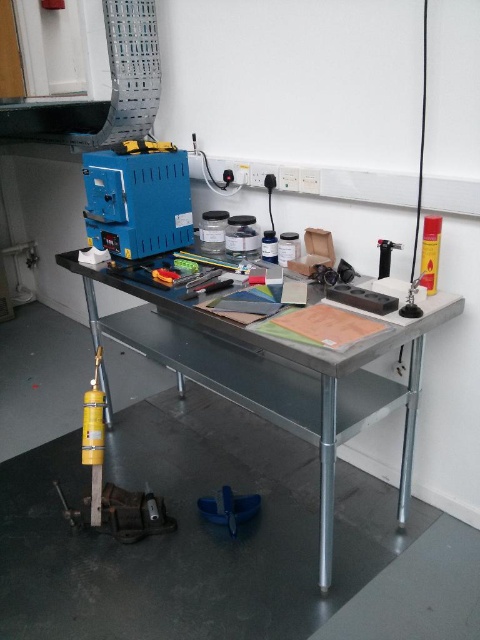
Which is in front, point (152, 216) or point (389, 243)?

Point (389, 243) is in front.

From the picture: Can you confirm if blue plastic tool at upper left is bigger than black plastic lighter at upper right?

Yes, blue plastic tool at upper left is bigger than black plastic lighter at upper right.

Describe the element at coordinates (137, 202) in the screenshot. I see `blue plastic tool at upper left` at that location.

Locate an element on the screen. blue plastic tool at upper left is located at coordinates (137, 202).

Does metallic gray table at center appear over metallic silver tool at center?

No, metallic gray table at center is not above metallic silver tool at center.

Between metallic gray table at center and metallic silver tool at center, which one is positioned lower?

metallic gray table at center is lower down.

Between point (297, 396) and point (193, 289), which one is positioned in front?

Point (297, 396)

I want to click on metallic gray table at center, so click(x=274, y=374).

Who is more forward, (406, 305) or (376, 243)?

Positioned in front is point (406, 305).

Does metallic silver tool at right appear over black plastic lighter at upper right?

Actually, metallic silver tool at right is below black plastic lighter at upper right.

Locate an element on the screen. The image size is (480, 640). metallic silver tool at right is located at coordinates (411, 298).

Find the location of a particular element. metallic silver tool at right is located at coordinates [411, 298].